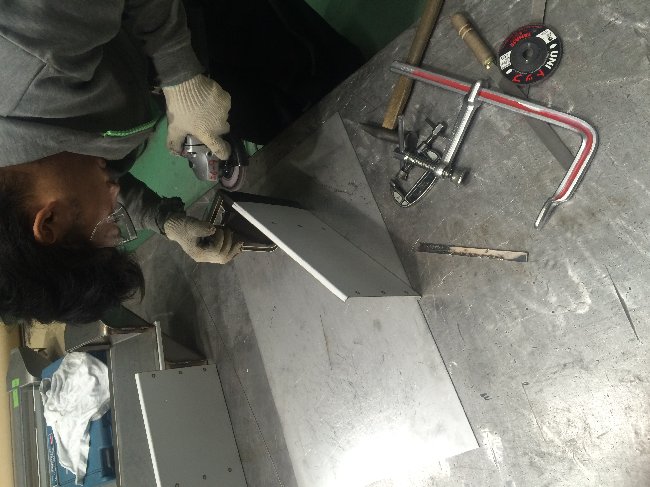
Locate an element on the screen. The width and height of the screenshot is (650, 487). board is located at coordinates (198, 431), (318, 261).